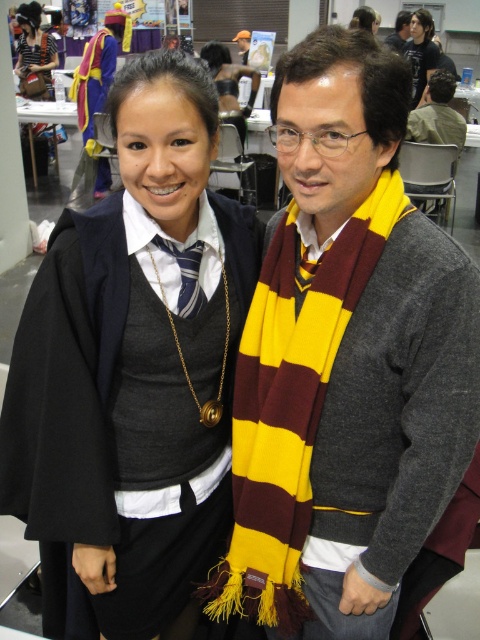
Question: Considering the real-world distances, which object is farthest from the brown leather jacket at upper right?

Choices:
 (A) yellow and maroon striped scarf at center
 (B) maroon and yellow striped scarf at right
 (C) matte black cape at center

Answer: (B)

Question: Which point is farther from the camera taking this photo?

Choices:
 (A) (288, 588)
 (B) (420, 193)

Answer: (B)

Question: Can you confirm if maroon and yellow striped scarf at right is wider than brown leather jacket at upper right?

Choices:
 (A) yes
 (B) no

Answer: (B)

Question: Is maroon and yellow striped scarf at right above yellow and maroon striped scarf at center?

Choices:
 (A) no
 (B) yes

Answer: (A)

Question: Can you confirm if matte black hair at upper center is smaller than yellow and maroon striped scarf at center?

Choices:
 (A) yes
 (B) no

Answer: (B)

Question: Which is farther from the yellow and maroon striped scarf at center?

Choices:
 (A) matte black cape at center
 (B) brown leather jacket at upper right
 (C) matte black hair at upper center
 (D) maroon and yellow striped scarf at right

Answer: (D)